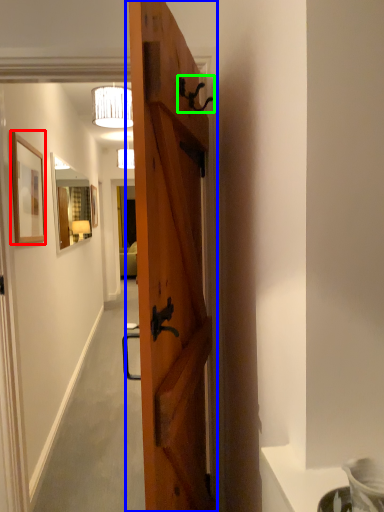
Question: Which object is the closest to the picture frame (highlighted by a red box)? Choose among these: door (highlighted by a blue box) or door handle (highlighted by a green box).

Choices:
 (A) door
 (B) door handle

Answer: (B)